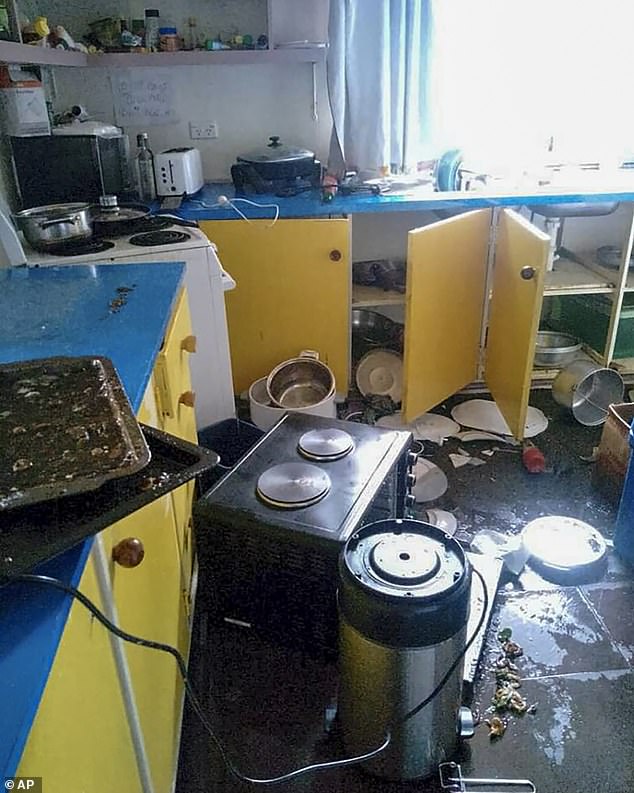
The width and height of the screenshot is (634, 793). Identify the location of drawer knobs. (188, 397), (189, 341).